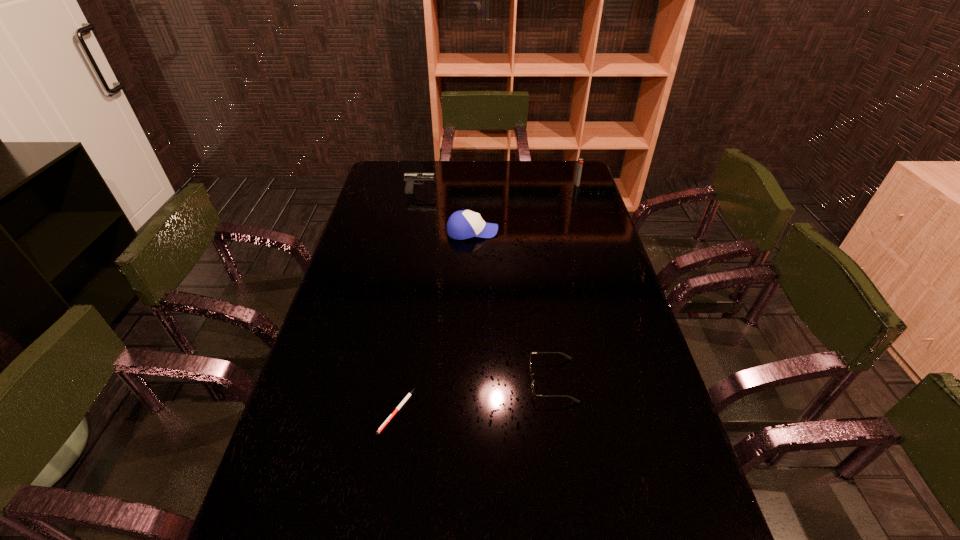
Find the location of `vacant area situated on the front-facing side of the third nearest object`. vacant area situated on the front-facing side of the third nearest object is located at coordinates (568, 232).

Image resolution: width=960 pixels, height=540 pixels. Find the location of `vacant region located 0.180m on the front-facing side of the fourth object from left to right`. vacant region located 0.180m on the front-facing side of the fourth object from left to right is located at coordinates 460,380.

What are the coordinates of `vacant region located on the front-facing side of the fourth object from left to right` in the screenshot? It's located at (498, 380).

Identify the location of blank space located 0.290m on the front-facing side of the fourth object from left to right. This screenshot has width=960, height=540. (418, 380).

The image size is (960, 540). I want to click on free space located on the clicker of the shortest object, so click(384, 493).

Identify the location of object that is at the far edge. (580, 160).

Where is `object that is at the left edge`? object that is at the left edge is located at coordinates (408, 177).

Where is `object that is at the right edge`? Image resolution: width=960 pixels, height=540 pixels. object that is at the right edge is located at coordinates (580, 160).

At what (x,y) coordinates should I click in order to perform the action: click on object located at the far right corner. Please return your answer as a coordinate pair (x, y). The height and width of the screenshot is (540, 960). Looking at the image, I should click on (580, 160).

In the image, there is a desktop. Identify the location of vacant area at the far edge. The image size is (960, 540). (477, 166).